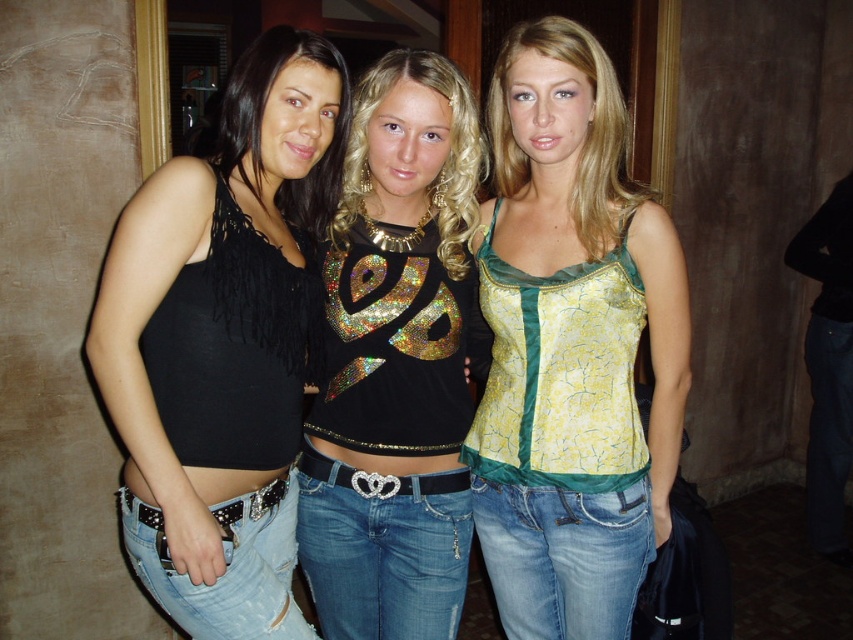
Is point (349, 611) closer to camera compared to point (354, 620)?

Yes, it is.

Is point (403, 83) farther from camera compared to point (370, 529)?

No, it is in front of (370, 529).

Locate an element on the screen. Image resolution: width=853 pixels, height=640 pixels. shiny sequined top at center is located at coordinates (395, 364).

Who is lower down, shiny sequined top at center or ripped denim jeans at center?

ripped denim jeans at center is lower down.

Can you confirm if shiny sequined top at center is positioned above ripped denim jeans at center?

Yes, shiny sequined top at center is above ripped denim jeans at center.

Who is more distant from viewer, (457, 189) or (274, 522)?

The point (457, 189) is behind.

Find the location of `shiny sequined top at center`. shiny sequined top at center is located at coordinates (395, 364).

Does point (461, 605) come closer to viewer compared to point (514, 512)?

No, (461, 605) is further to viewer.

Is jeans at center thinner than denim jeans at center?

No, jeans at center is not thinner than denim jeans at center.

What do you see at coordinates (383, 548) in the screenshot?
I see `jeans at center` at bounding box center [383, 548].

Where is `jeans at center`? The height and width of the screenshot is (640, 853). jeans at center is located at coordinates (383, 548).